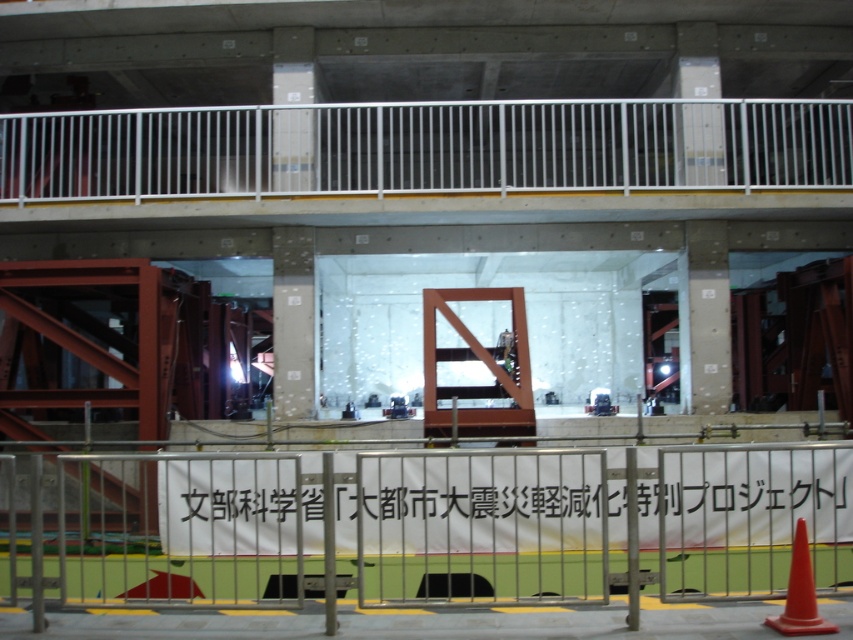
Question: Can you confirm if silver metallic fence at lower center is positioned below white paper banner at center?

Choices:
 (A) yes
 (B) no

Answer: (A)

Question: Which of the following is the closest to the observer?

Choices:
 (A) white paper banner at center
 (B) orange matte traffic cone at lower right
 (C) silver metallic fence at lower center

Answer: (B)

Question: Which of the following is the farthest from the observer?

Choices:
 (A) orange matte traffic cone at lower right
 (B) white paper banner at center
 (C) silver metallic fence at lower center

Answer: (B)

Question: Is silver metallic fence at lower center closer to camera compared to orange matte traffic cone at lower right?

Choices:
 (A) yes
 (B) no

Answer: (B)

Question: Is silver metallic fence at lower center further to the viewer compared to orange matte traffic cone at lower right?

Choices:
 (A) yes
 (B) no

Answer: (A)

Question: Which object is farther from the camera taking this photo?

Choices:
 (A) orange matte traffic cone at lower right
 (B) silver metallic fence at lower center

Answer: (B)